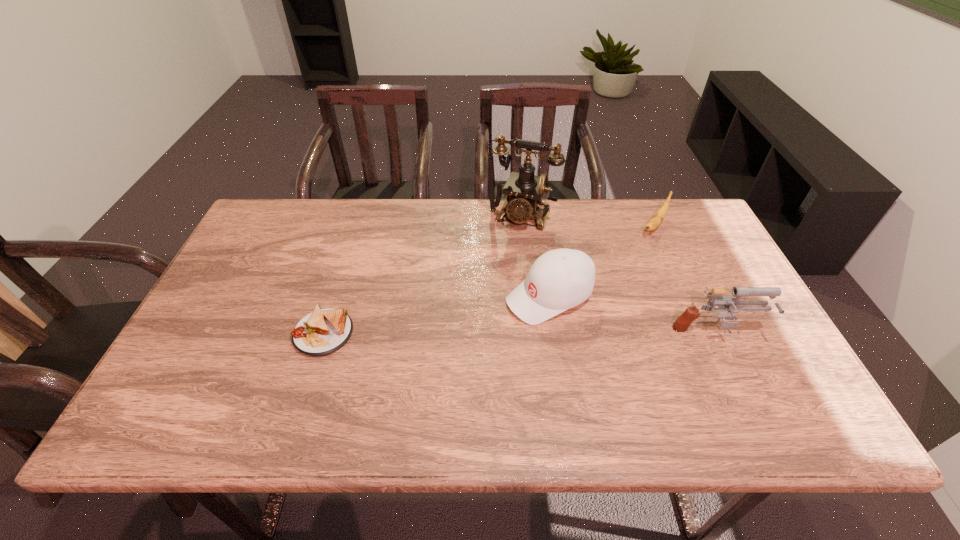
The image size is (960, 540). I want to click on free spot on the desktop that is between the leftmost object and the gun and is positioned on the front-facing side of the baseball cap, so click(471, 334).

Locate an element on the screen. Image resolution: width=960 pixels, height=540 pixels. free space on the desktop that is between the shortest object and the gun and is positioned on the rotary dial of the tallest object is located at coordinates (471, 334).

This screenshot has height=540, width=960. Identify the location of vacant space on the desktop that is between the sandwich and the gun and is positioned on the peel of the fourth tallest object from the top. (569, 334).